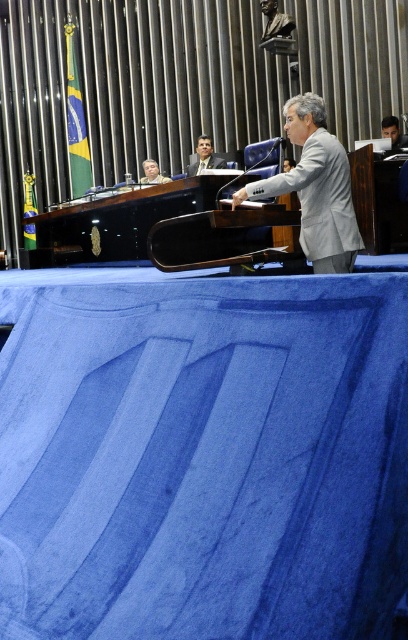
Consider the image. You are attending a meeting in this assembly room and need to place a document on the nearest matte black laptop. Which one should you choose between the matte black laptop at upper right and the matte black laptop at upper center?

The matte black laptop at upper center is closer to you, so you should place the document there.